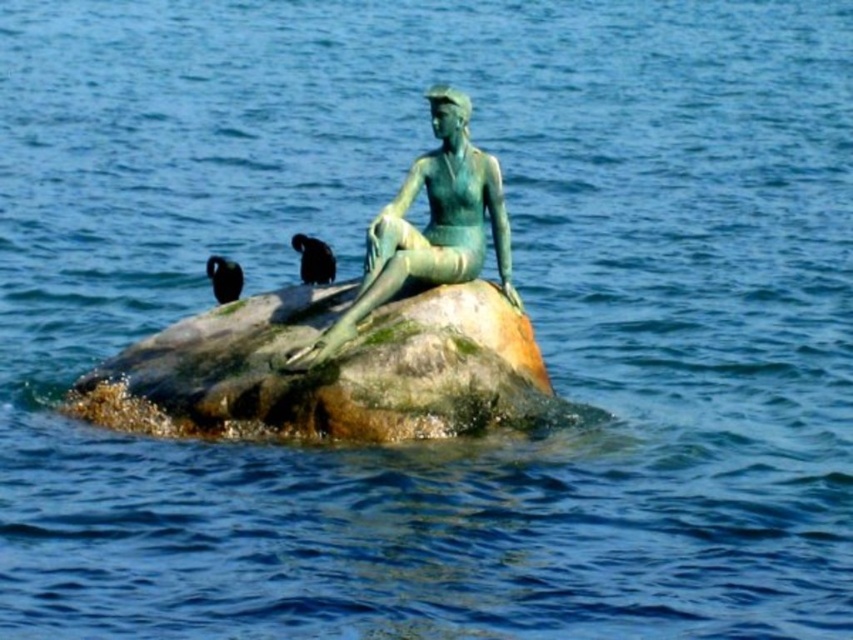
Question: Is green patina rock at center smaller than green patina bronze statue at center?

Choices:
 (A) yes
 (B) no

Answer: (B)

Question: Which point is farther to the camera?

Choices:
 (A) (538, 365)
 (B) (440, 209)

Answer: (A)

Question: Is green patina rock at center bigger than green patina bronze statue at center?

Choices:
 (A) no
 (B) yes

Answer: (B)

Question: Which object appears farthest from the camera in this image?

Choices:
 (A) green patina rock at center
 (B) green patina bronze statue at center

Answer: (B)

Question: Considering the relative positions of green patina rock at center and green patina bronze statue at center in the image provided, where is green patina rock at center located with respect to green patina bronze statue at center?

Choices:
 (A) right
 (B) left

Answer: (B)

Question: Which point is farther from the camera taking this photo?

Choices:
 (A) (439, 138)
 (B) (380, 358)

Answer: (A)